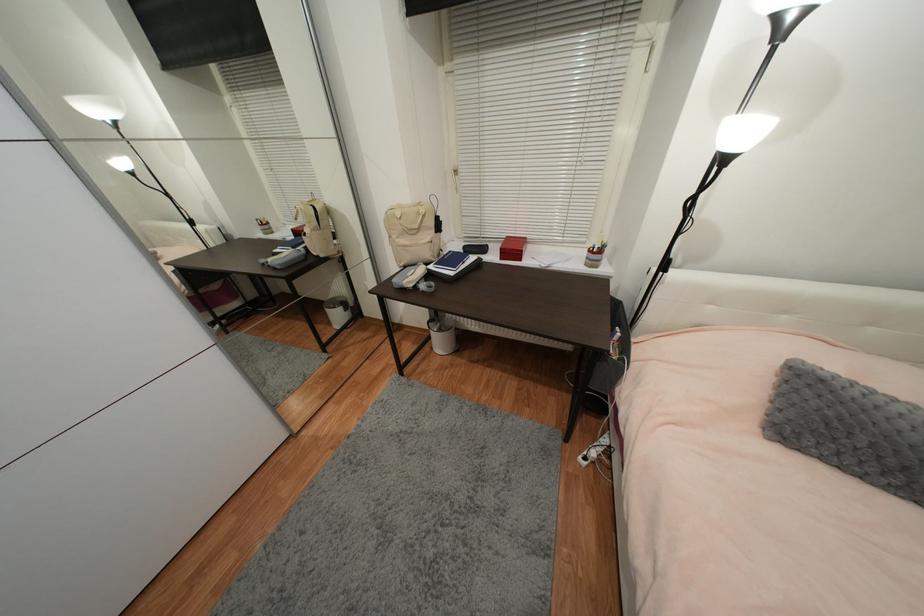
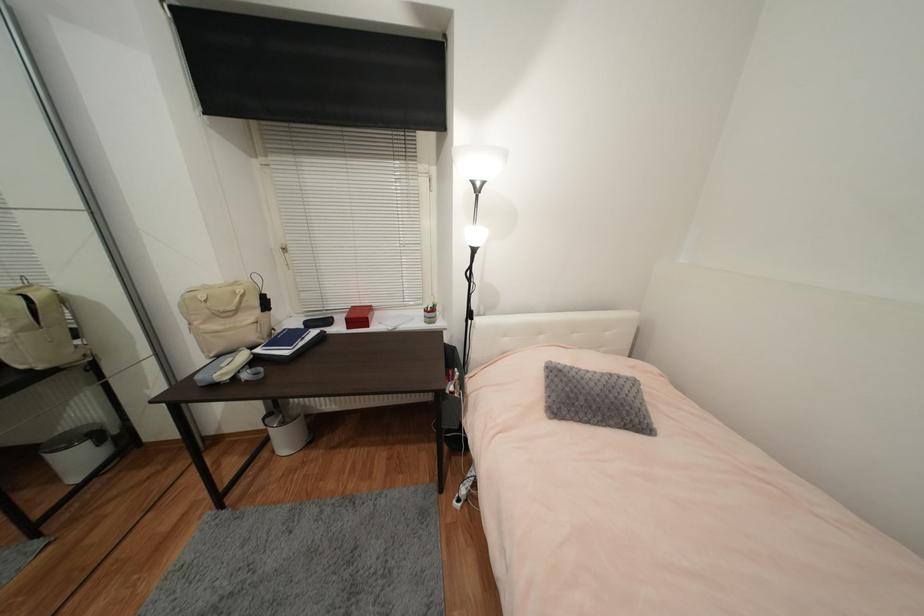
Locate, in the second image, the point that corresponds to pixel 467 268 in the first image.

(306, 344)